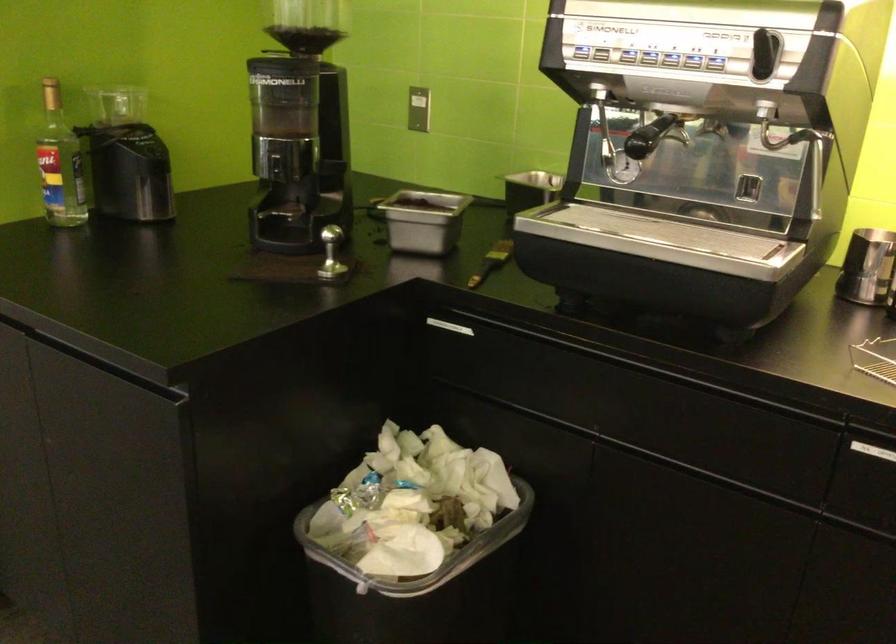
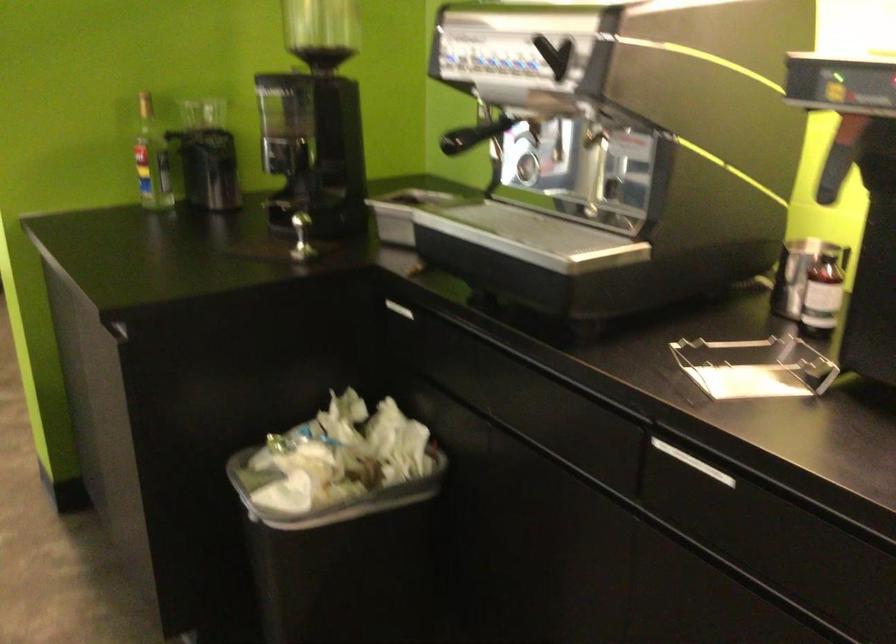
Locate, in the second image, the point that corresponds to the point at 69,163 in the first image.

(151, 158)